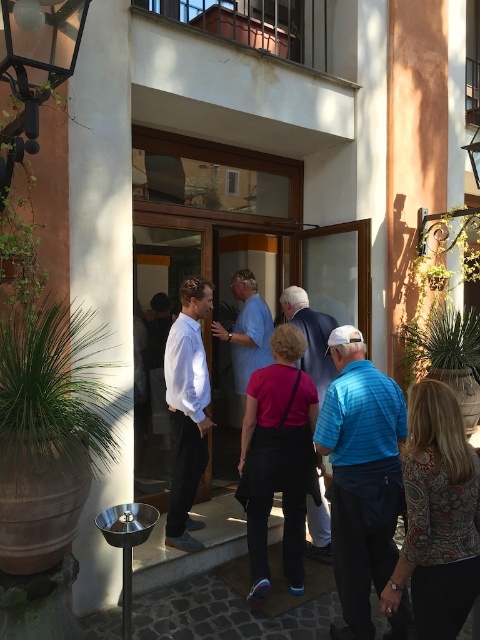
You are standing in front of the building entrance and want to walk towards the two points marked in the image. Which point, point (108,260) or point (417,541), will you reach first?

You will reach point (108,260) first because it is closer to you than point (417,541), which is further away.

You are planning to place a new decorative item in the scene. The item is the size of the silver metallic pole at left. Would it fit in the space currently occupied by the white smooth shirt at center without overlapping?

The silver metallic pole at left occupies less space than the white smooth shirt at center, so the decorative item would fit in the space without overlapping.